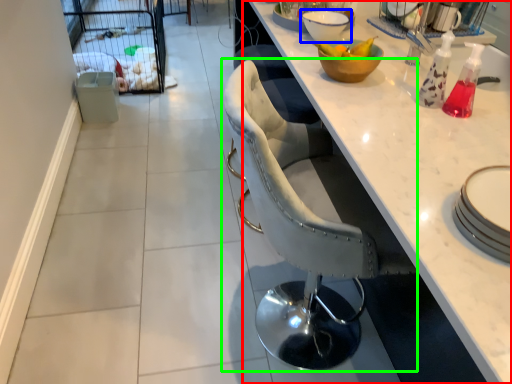
Question: Considering the real-world distances, which object is farthest from countertop (highlighted by a red box)? bowl (highlighted by a blue box) or chair (highlighted by a green box)?

Choices:
 (A) bowl
 (B) chair

Answer: (A)